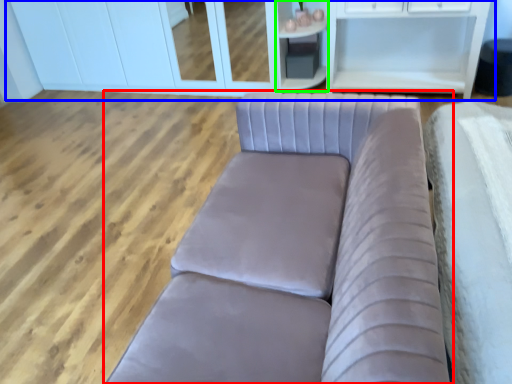
Question: Considering the real-world distances, which object is closest to studio couch (highlighted by a red box)? dresser (highlighted by a blue box) or cabinetry (highlighted by a green box).

Choices:
 (A) dresser
 (B) cabinetry

Answer: (B)